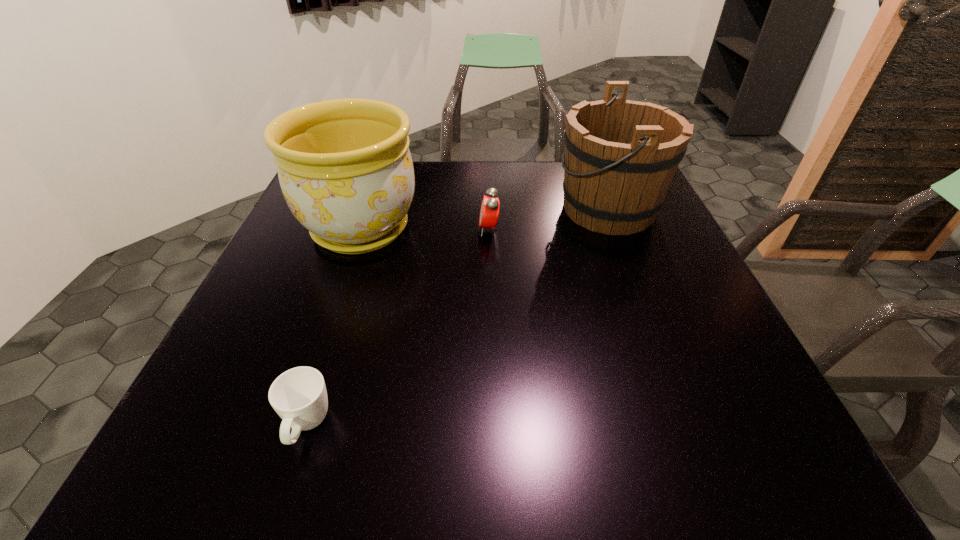
You are a GUI agent. You are given a task and a screenshot of the screen. Output one action in this format:
    pyautogui.click(x=<x>, y=<y>)
    Task: Click on the vacant space located 0.100m on the front-facing side of the third tallest object
    The width and height of the screenshot is (960, 540).
    Given the screenshot: What is the action you would take?
    pyautogui.click(x=440, y=230)

Locate an element on the screen. The width and height of the screenshot is (960, 540). free location located 0.080m on the front-facing side of the third tallest object is located at coordinates (447, 230).

Locate an element on the screen. vacant area located on the front-facing side of the third tallest object is located at coordinates (428, 230).

Find the location of a particular element. The image size is (960, 540). wine bucket at the far edge is located at coordinates 620,155.

The width and height of the screenshot is (960, 540). I want to click on flowerpot at the far edge, so click(345, 169).

The width and height of the screenshot is (960, 540). I want to click on object that is at the near edge, so click(299, 396).

Identify the location of object present at the left edge. (345, 169).

Find the location of `object that is positioned at the right edge`. object that is positioned at the right edge is located at coordinates (620, 155).

Identify the location of object present at the far left corner. (345, 169).

Find the location of a particular element. object located in the far right corner section of the desktop is located at coordinates (620, 155).